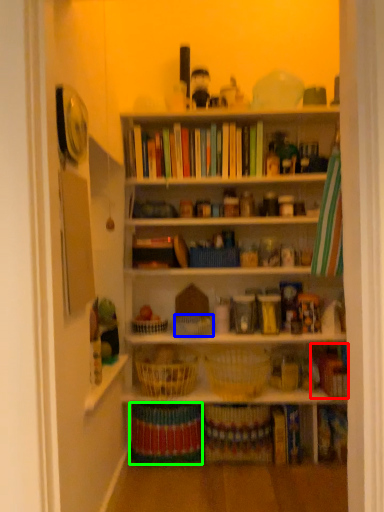
Question: Considering the real-world distances, which object is closest to book (highlighted by a red box)? basket (highlighted by a blue box) or book (highlighted by a green box).

Choices:
 (A) basket
 (B) book

Answer: (A)